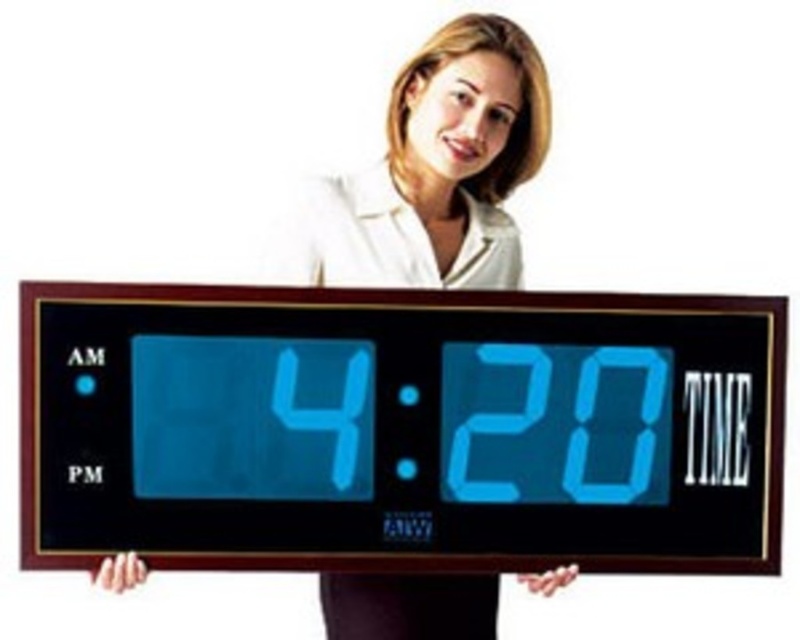
Question: Can you confirm if blue lcd display at center is positioned above white smooth shirt at upper center?

Choices:
 (A) yes
 (B) no

Answer: (B)

Question: Among these points, which one is farthest from the camera?

Choices:
 (A) (726, 513)
 (B) (478, 276)

Answer: (B)

Question: Does blue lcd display at center come behind white smooth shirt at upper center?

Choices:
 (A) yes
 (B) no

Answer: (B)

Question: Where is blue lcd display at center located in relation to white smooth shirt at upper center in the image?

Choices:
 (A) left
 (B) right

Answer: (A)